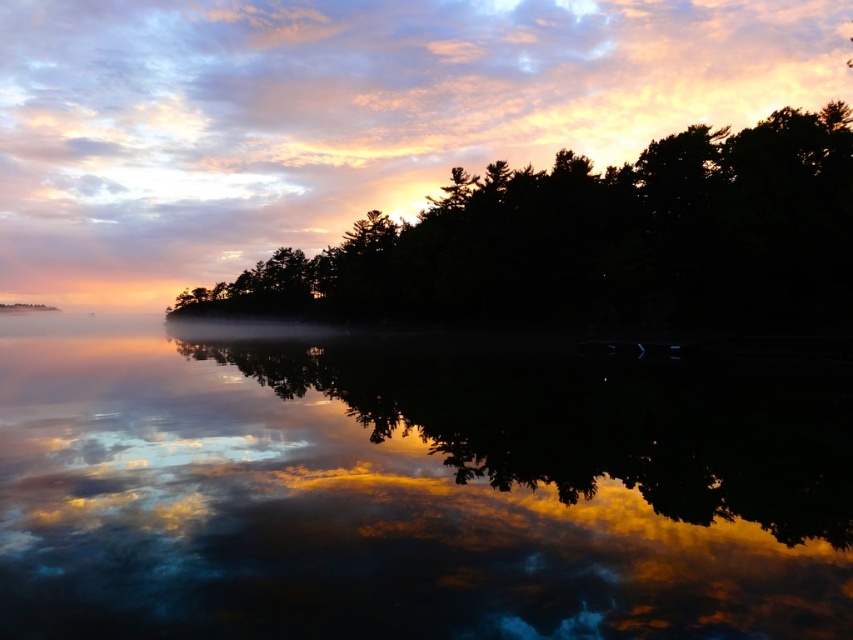
Can you confirm if glossy reflective water at center is taller than silhouette tree at center?

Incorrect, glossy reflective water at center's height is not larger of silhouette tree at center's.

Locate an element on the screen. glossy reflective water at center is located at coordinates (405, 490).

You are a GUI agent. You are given a task and a screenshot of the screen. Output one action in this format:
    pyautogui.click(x=<x>, y=<y>)
    Task: Click on the glossy reflective water at center
    The width and height of the screenshot is (853, 640).
    Given the screenshot: What is the action you would take?
    (x=405, y=490)